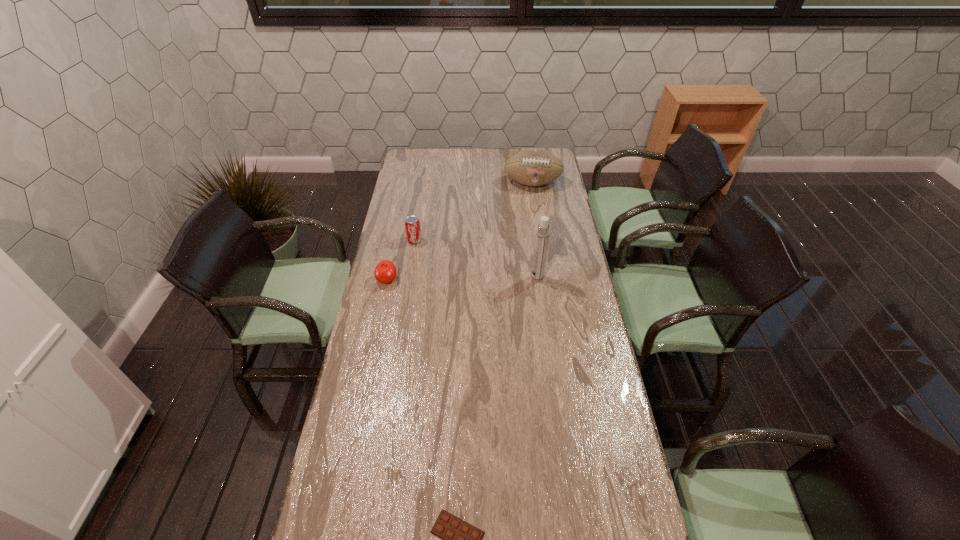
You are a GUI agent. You are given a task and a screenshot of the screen. Output one action in this format:
    pyautogui.click(x=<x>, y=<y>)
    Task: Click on the free space between the apple and the aerosol can
    Image resolution: width=960 pixels, height=540 pixels.
    Given the screenshot: What is the action you would take?
    pyautogui.click(x=462, y=279)

Locate an element on the screen. vacant space in between the fourth object from right to left and the football (American) is located at coordinates (473, 212).

Where is `vacant space that is in between the soda can and the fourth tallest object`? This screenshot has height=540, width=960. vacant space that is in between the soda can and the fourth tallest object is located at coordinates (400, 260).

Where is `vacant region between the second farthest object and the aerosol can`? Image resolution: width=960 pixels, height=540 pixels. vacant region between the second farthest object and the aerosol can is located at coordinates (476, 259).

Point out which object is positioned as the second nearest to the fourth nearest object. Please provide its 2D coordinates. Your answer should be formatted as a tuple, i.e. [(x, y)], where the tuple contains the x and y coordinates of a point satisfying the conditions above.

[(542, 233)]

The height and width of the screenshot is (540, 960). What are the coordinates of `object that can be found as the second closest to the tallest object` in the screenshot? It's located at (385, 272).

Identify the location of vacant point that satisfies the following two spatial constraints: 1. on the back side of the third shortest object; 2. on the left side of the apple. The image size is (960, 540). (396, 240).

You are a GUI agent. You are given a task and a screenshot of the screen. Output one action in this format:
    pyautogui.click(x=<x>, y=<y>)
    Task: Click on the vacant space that satisfies the following two spatial constraints: 1. on the back side of the aerosol can; 2. on the right side of the leftmost object
    
    Given the screenshot: What is the action you would take?
    pyautogui.click(x=388, y=278)